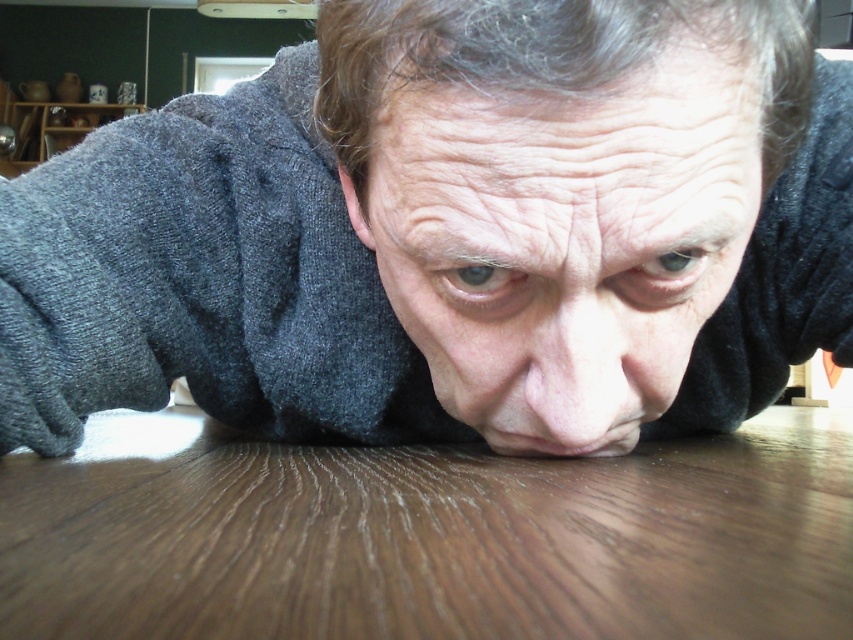
Can you confirm if dark gray sweater at center is bigger than brown wood table at center?

Correct, dark gray sweater at center is larger in size than brown wood table at center.

Between dark gray sweater at center and brown wood table at center, which one is positioned higher?

dark gray sweater at center is above.

Is point (519, 77) positioned in front of point (103, 461)?

Yes.

Find the location of `dark gray sweater at center`. dark gray sweater at center is located at coordinates (450, 232).

Consider the image. Can you confirm if brown wood table at center is thinner than smooth skin face at center?

No.

Locate an element on the screen. This screenshot has width=853, height=640. brown wood table at center is located at coordinates [x=427, y=536].

Which is below, dark gray sweater at center or smooth skin face at center?

smooth skin face at center

Which is behind, point (805, 28) or point (740, 81)?

The point (805, 28) is more distant.

Between point (813, 314) and point (648, 413), which one is positioned behind?

The point (813, 314) is behind.

You are a GUI agent. You are given a task and a screenshot of the screen. Output one action in this format:
    pyautogui.click(x=<x>, y=<y>)
    Task: Click on the dark gray sweater at center
    
    Given the screenshot: What is the action you would take?
    pyautogui.click(x=450, y=232)